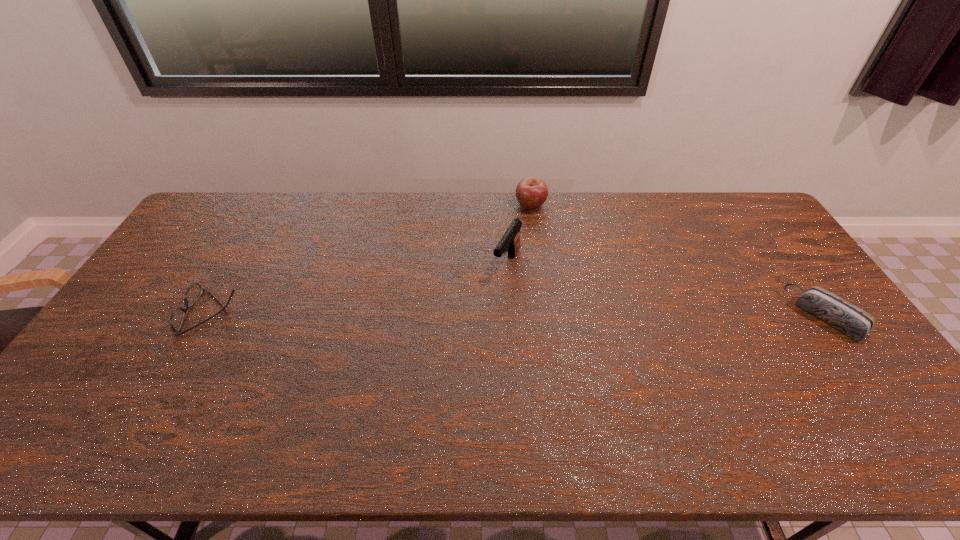
Identify the location of vacant space that's between the third tallest object and the spectacles. (518, 314).

Point out which object is positioned as the nearest to the third tallest object. Please provide its 2D coordinates. Your answer should be formatted as a tuple, i.e. [(x, y)], where the tuple contains the x and y coordinates of a point satisfying the conditions above.

[(531, 193)]

Where is `object that is the second closest one to the leftmost object`? object that is the second closest one to the leftmost object is located at coordinates (531, 193).

Where is `blank area in the image that satisfies the following two spatial constraints: 1. on the back side of the second farthest object; 2. on the right side of the second tallest object`? The width and height of the screenshot is (960, 540). blank area in the image that satisfies the following two spatial constraints: 1. on the back side of the second farthest object; 2. on the right side of the second tallest object is located at coordinates (503, 205).

Image resolution: width=960 pixels, height=540 pixels. I want to click on vacant region that satisfies the following two spatial constraints: 1. on the front side of the apple; 2. on the right side of the pencil box, so point(545,315).

Where is `vacant position in the image that satisfies the following two spatial constraints: 1. on the front side of the second tallest object; 2. on the left side of the second shortest object`? vacant position in the image that satisfies the following two spatial constraints: 1. on the front side of the second tallest object; 2. on the left side of the second shortest object is located at coordinates (545, 315).